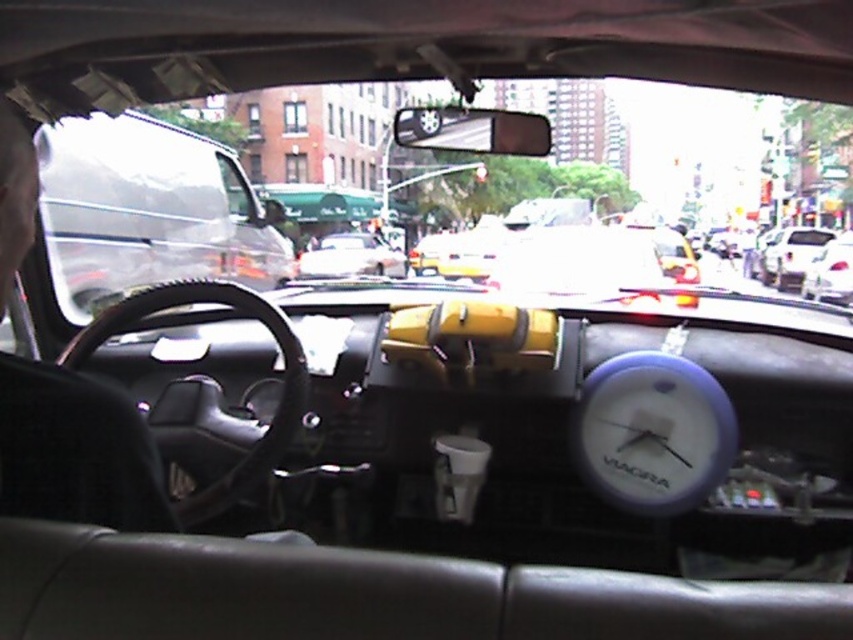
Does white plastic clock at center have a lesser height compared to white glossy sedan at right?

Yes.

Based on the photo, who is more distant from viewer, (624,438) or (759,268)?

Point (759,268)

You are a GUI agent. You are given a task and a screenshot of the screen. Output one action in this format:
    pyautogui.click(x=<x>, y=<y>)
    Task: Click on the white plastic clock at center
    The height and width of the screenshot is (640, 853).
    Given the screenshot: What is the action you would take?
    pyautogui.click(x=653, y=433)

Who is positioned more to the left, white plastic clock at center or yellow matte taxi at center?

From the viewer's perspective, yellow matte taxi at center appears more on the left side.

Is white plastic clock at center smaller than yellow matte taxi at center?

Yes, white plastic clock at center is smaller than yellow matte taxi at center.

Does point (654, 492) lie behind point (399, 257)?

No.

Where is `white plastic clock at center`? white plastic clock at center is located at coordinates (653, 433).

Can you confirm if yellow matte taxi at center is thinner than white glossy sedan at right?

Yes, yellow matte taxi at center is thinner than white glossy sedan at right.

Image resolution: width=853 pixels, height=640 pixels. In order to click on yellow matte taxi at center in this screenshot , I will do click(351, 257).

Is point (334, 241) positioned before point (795, 285)?

No.

You are a GUI agent. You are given a task and a screenshot of the screen. Output one action in this format:
    pyautogui.click(x=<x>, y=<y>)
    Task: Click on the yellow matte taxi at center
    Image resolution: width=853 pixels, height=640 pixels.
    Given the screenshot: What is the action you would take?
    pyautogui.click(x=351, y=257)